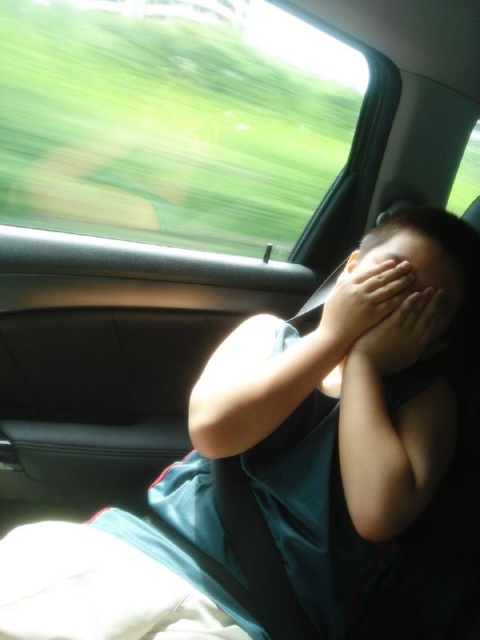
You are a passenger in the car and want to check if the matte skin face at center is resting on the matte skin hand at center. Based on their positions, is this possible?

The matte skin hand at center is located below the matte skin face at center, so yes, the face could be resting on the hand.

You are a passenger in the car and want to see the scenery outside through the transparent glass car window at upper left without moving your head. Can the matte skin face at center block your view of the window?

The transparent glass car window at upper left is taller than the matte skin face at center, so the face will not block the entire view of the window. However, part of the window might be obscured depending on the exact positioning.

You are a photographer trying to capture the child in the car. You want to ensure the hand at point (362,301) is in focus. Which part of the child should you focus on to achieve this?

The matte skin hand at center represented by point (362,301) should be focused on to ensure it is in focus.